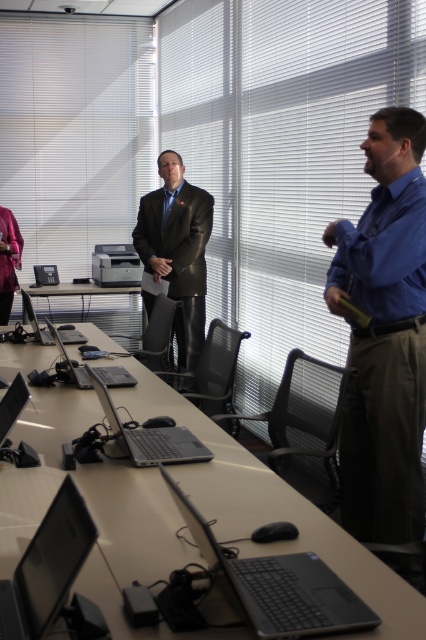
Question: Among these objects, which one is nearest to the camera?

Choices:
 (A) matte black printer at left
 (B) matte black laptop at center

Answer: (B)

Question: Is light brown wooden table at center smaller than matte black table at center?

Choices:
 (A) yes
 (B) no

Answer: (B)

Question: Can you confirm if black matte laptop at center is positioned below matte black table at center?

Choices:
 (A) yes
 (B) no

Answer: (A)

Question: Can you confirm if satin black laptop at lower left is positioned to the left of silver metallic laptop at center?

Choices:
 (A) no
 (B) yes

Answer: (A)

Question: Which of these objects is positioned closest to the black leather jacket at center?

Choices:
 (A) black matte laptop at center
 (B) light brown wooden table at center

Answer: (B)

Question: Which object is farther from the camera taking this photo?

Choices:
 (A) satin black laptop at lower left
 (B) light brown wooden table at center
 (C) matte black printer at left

Answer: (C)